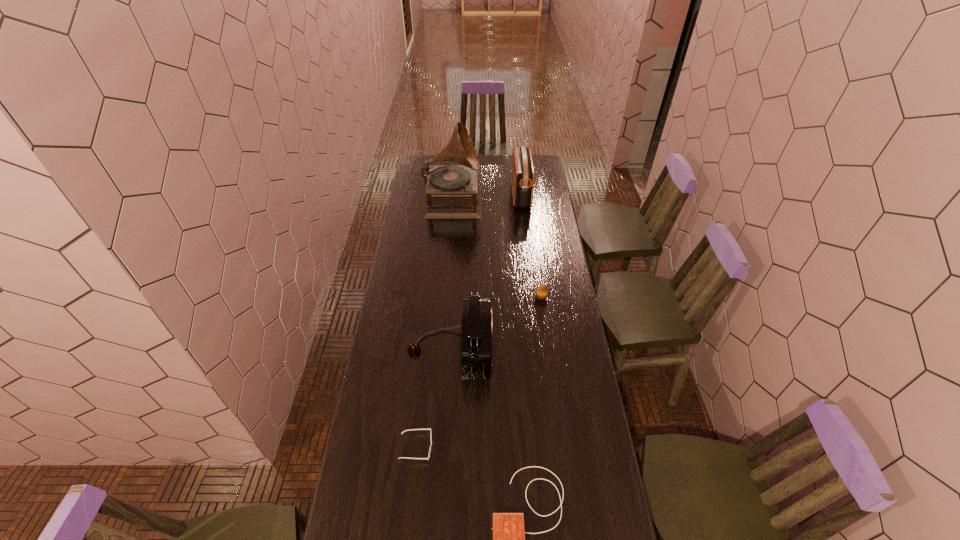
Find the location of a particular element. This screenshot has height=540, width=960. vacant space positioned 0.320m on the front-facing side of the second farthest radio receiver is located at coordinates (570, 349).

Find the location of `free point located 0.050m on the back of the fourth nearest object`. free point located 0.050m on the back of the fourth nearest object is located at coordinates (540, 286).

Where is `free region located with the lenses of the sunglasses facing outward`? free region located with the lenses of the sunglasses facing outward is located at coordinates click(493, 447).

Identify the location of record player located in the left edge section of the desktop. (453, 192).

Locate an element on the screen. radio receiver present at the left edge is located at coordinates pyautogui.click(x=476, y=325).

Find the location of a particular element. sunglasses at the left edge is located at coordinates (x=430, y=428).

At what (x,y) coordinates should I click in order to perform the action: click on radio receiver that is at the right edge. Please return your answer as a coordinate pair (x, y). Looking at the image, I should click on click(522, 174).

Locate an element on the screen. pear that is at the right edge is located at coordinates (541, 293).

Find the location of `blank space at the far edge of the desktop`. blank space at the far edge of the desktop is located at coordinates tap(443, 165).

The width and height of the screenshot is (960, 540). In the image, there is a desktop. Find the location of `vacant space at the left edge`. vacant space at the left edge is located at coordinates (394, 279).